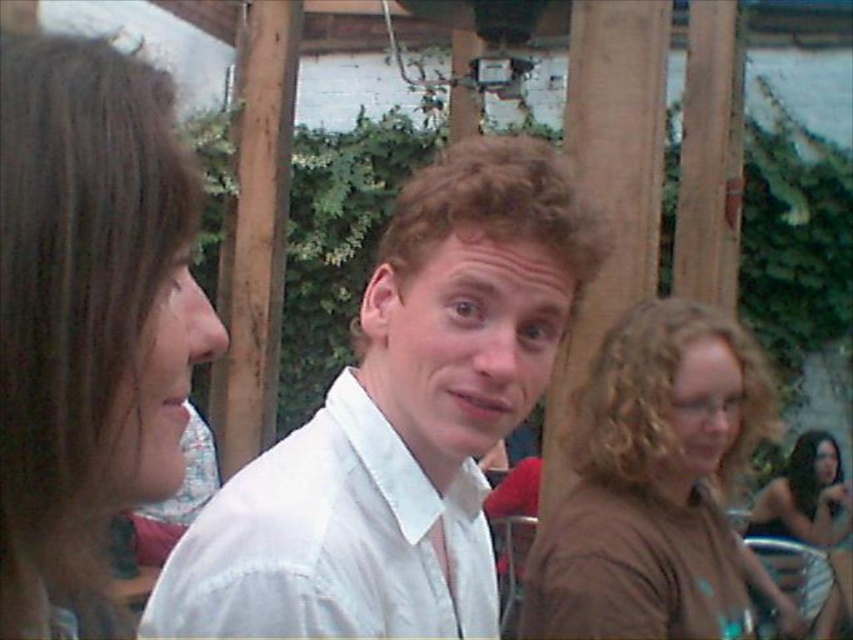
You are a photographer at the beach who needs to capture a photo of both the white cotton dress shirt at center and the silver metallic bikini at lower right. Which object should you focus on first if you want to ensure both are in the frame without moving the camera?

The white cotton dress shirt at center is shorter than the silver metallic bikini at lower right, so you should focus on the silver metallic bikini at lower right first to ensure both are in the frame without moving the camera.

You are at a beach party and see the curly blonde hair at right and the silver metallic bikini at lower right. Which object is located higher in the image?

The curly blonde hair at right is positioned over silver metallic bikini at lower right, so it is higher in the image.

You are a photographer at the event and want to adjust your camera to focus on the white cotton shirt at center and the brown hair at left. Which object should you focus on first if you need to prioritize the one closer to the camera?

The white cotton shirt at center is located above brown hair at left, so it is closer to the camera. Focus on the white cotton shirt at center first.